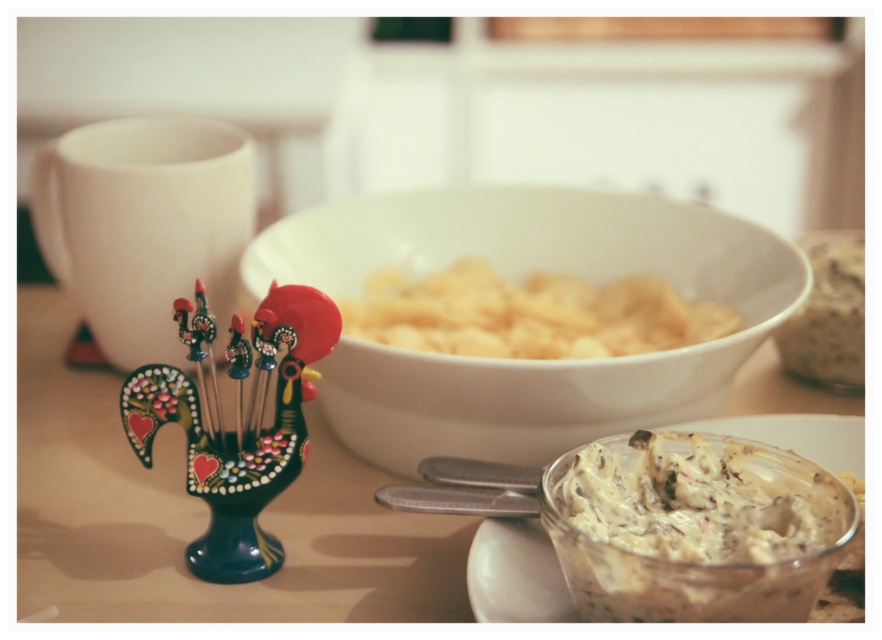
Can you confirm if white matte bowl at center is wider than painted ceramic rooster at left?

Yes.

Consider the image. Can you confirm if white matte bowl at center is taller than painted ceramic rooster at left?

Correct, white matte bowl at center is much taller as painted ceramic rooster at left.

The image size is (882, 640). I want to click on white matte bowl at center, so click(x=520, y=276).

Can you confirm if white creamy dip at center is positioned below painted ceramic rooster at left?

Yes, white creamy dip at center is below painted ceramic rooster at left.

Where is `white creamy dip at center`? The height and width of the screenshot is (640, 882). white creamy dip at center is located at coordinates (696, 529).

In order to click on white creamy dip at center in this screenshot , I will do `click(696, 529)`.

Which is above, painted ceramic rooster at left or white matte chips at center?

white matte chips at center is above.

Between point (245, 480) and point (423, 333), which one is positioned behind?

Positioned behind is point (423, 333).

Identify the location of painted ceramic rooster at left. The width and height of the screenshot is (882, 640). (236, 420).